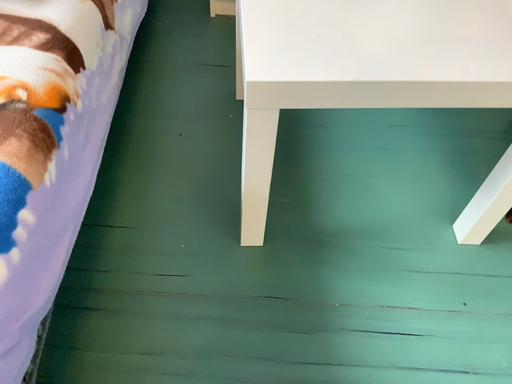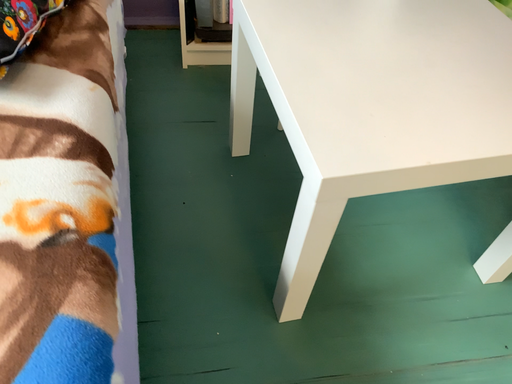
Question: How did the camera likely rotate when shooting the video?

Choices:
 (A) rotated right
 (B) rotated left

Answer: (A)